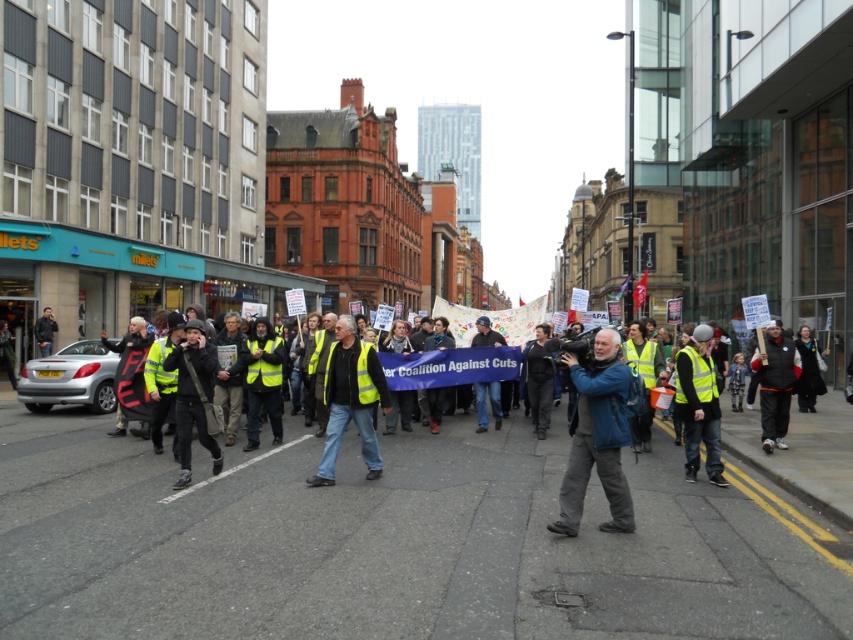
You are a photographer attending the protest. You notice a blue fabric camera at center and a yellow reflective vest at center. Which object would you need to adjust your lens focus for if you want to capture both in sharp detail?

The blue fabric camera at center is smaller than the yellow reflective vest at center, so you would need to adjust your lens focus to ensure both are in sharp detail, focusing on the smaller object first as it requires more precision.

Based on the photo, you are a photographer taking a picture of the protest march. You notice two points in the scene at coordinates point [618,419] and point [798,358]. Which point should you focus on to ensure it appears sharper in the photo?

Point [618,419] is closer to the camera than point [798,358], so focusing on point [618,419] will result in a sharper image.

You are a photographer trying to capture a photo of the protesters. You notice two individuals in the crowd wearing a yellow reflective vest at center and a dark gray fleece jacket at right. Which clothing item is shorter in height?

The yellow reflective vest at center is shorter than the dark gray fleece jacket at right.